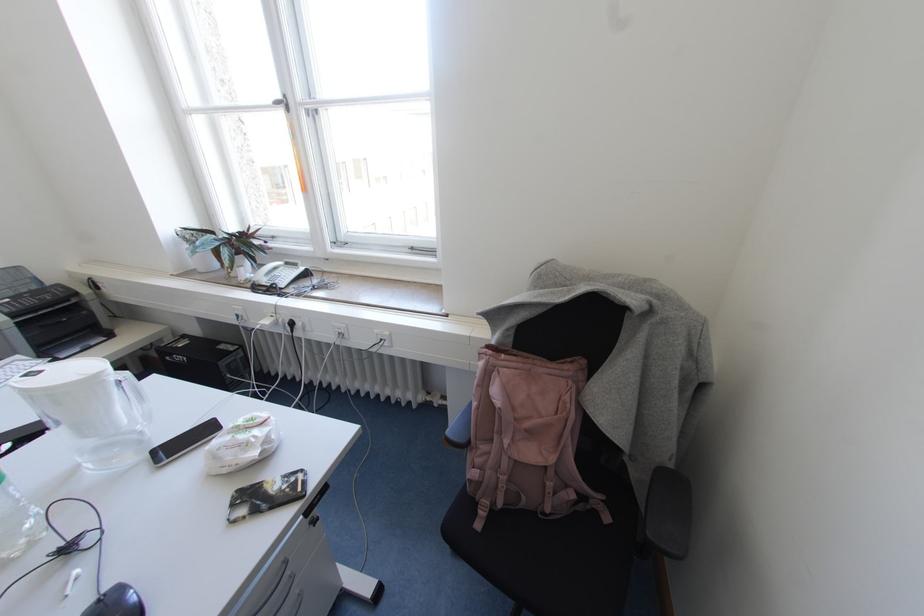
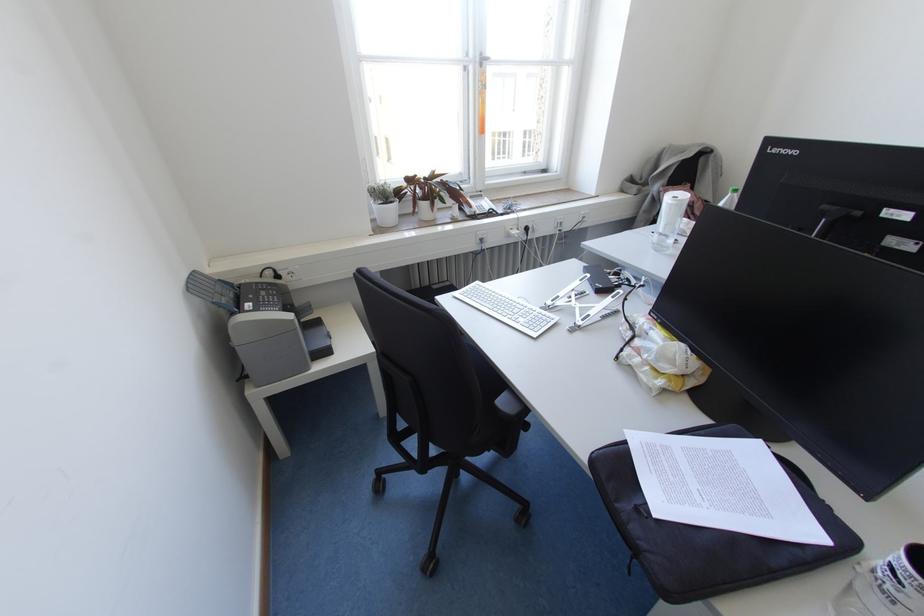
Where in the second image is the point corresponding to the point at 287,108 from the first image?

(480, 65)